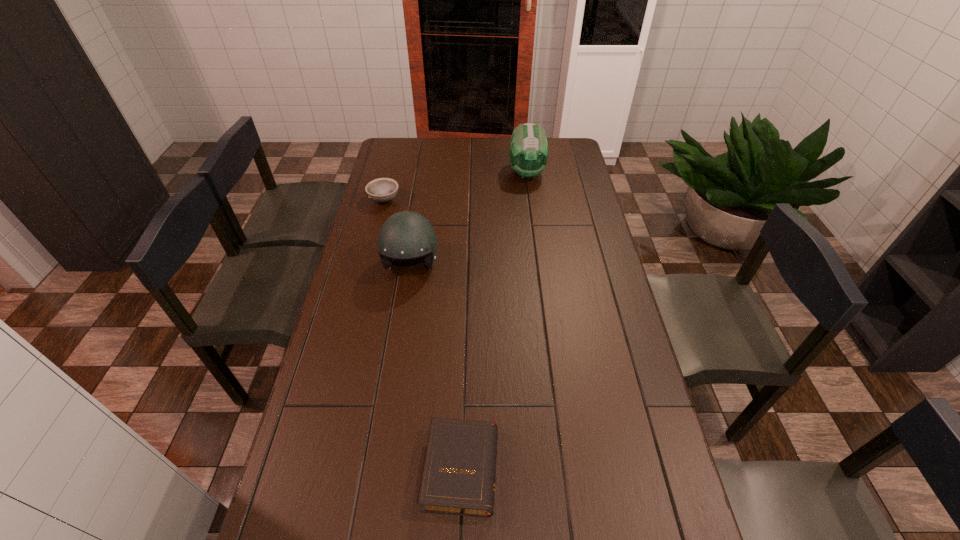
You are a GUI agent. You are given a task and a screenshot of the screen. Output one action in this format:
    pyautogui.click(x=<x>, y=<y>)
    Task: Click on the farthest object
    
    Given the screenshot: What is the action you would take?
    pyautogui.click(x=528, y=154)

Locate an element on the screen. This screenshot has height=540, width=960. the farther football helmet is located at coordinates (528, 154).

Find the location of `the second nearest object`. the second nearest object is located at coordinates (405, 235).

This screenshot has height=540, width=960. What are the coordinates of `the left football helmet` in the screenshot? It's located at click(x=405, y=235).

Locate an element on the screen. the third nearest object is located at coordinates (381, 190).

You are a GUI agent. You are given a task and a screenshot of the screen. Output one action in this format:
    pyautogui.click(x=<x>, y=<y>)
    Task: Click on the second shortest object
    
    Given the screenshot: What is the action you would take?
    pyautogui.click(x=381, y=190)

I want to click on the nearest object, so click(x=459, y=472).

Find the location of a particular element. Bible is located at coordinates (459, 472).

This screenshot has height=540, width=960. In order to click on vacant space located on the visor of the farthest object in this screenshot , I will do `click(535, 232)`.

Where is `vacant space located at the face opening of the second nearest object`? The image size is (960, 540). vacant space located at the face opening of the second nearest object is located at coordinates (400, 335).